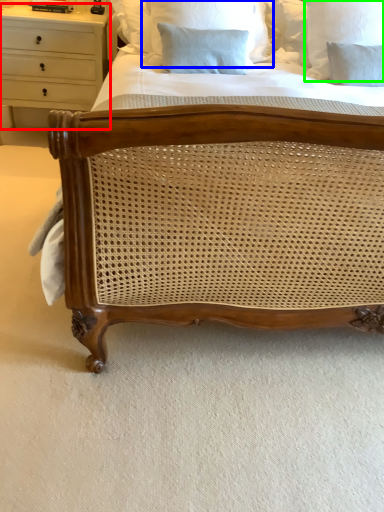
Question: Which object is positioned closest to chest of drawers (highlighted by a red box)? Select from pillow (highlighted by a blue box) and pillow (highlighted by a green box).

Choices:
 (A) pillow
 (B) pillow

Answer: (A)